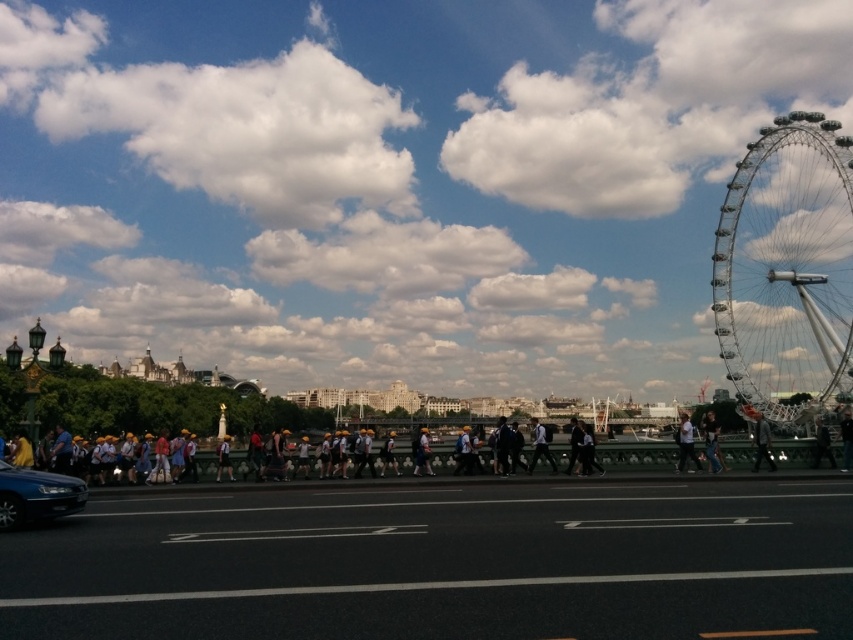
Between point (767, 422) and point (218, 472), which one is positioned in front?

Positioned in front is point (218, 472).

Between point (763, 442) and point (230, 464), which one is positioned behind?

The point (763, 442) is behind.

This screenshot has height=640, width=853. Find the location of `dark gray jacket at center`. dark gray jacket at center is located at coordinates 759,436.

Who is taller, silver metallic ferris wheel at right or dark blue jeans at center?

silver metallic ferris wheel at right

Find the location of `silver metallic ferris wheel at right`. silver metallic ferris wheel at right is located at coordinates (787, 269).

Which is behind, point (764, 294) or point (844, 444)?

Point (764, 294)

This screenshot has height=640, width=853. What are the coordinates of `silver metallic ferris wheel at right` in the screenshot? It's located at (787, 269).

Is point (721, 461) positioned behind point (849, 436)?

Yes, it is.

Does denim jacket at center come in front of dark blue jeans at center?

No, it is behind dark blue jeans at center.

The height and width of the screenshot is (640, 853). What are the coordinates of `denim jacket at center` in the screenshot? It's located at (711, 442).